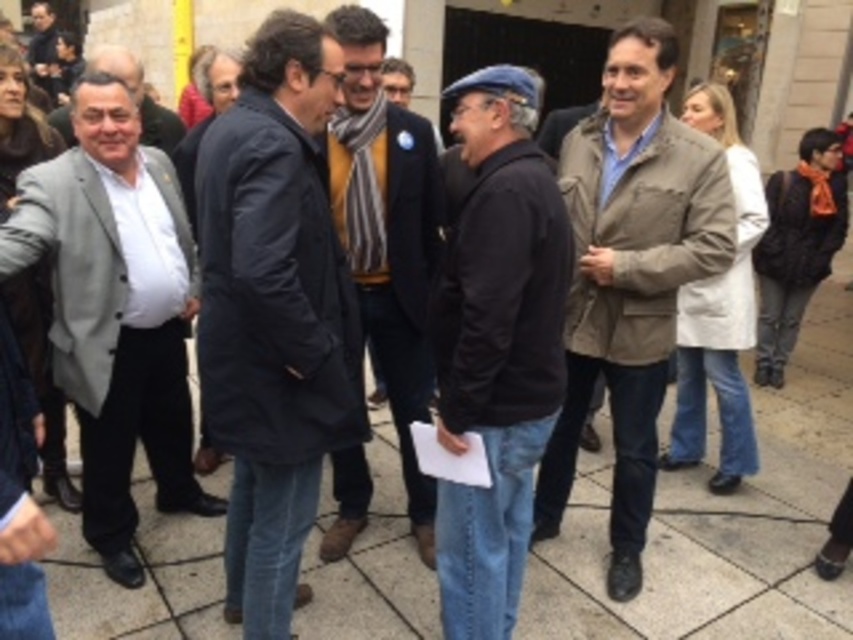
Between point (503, 90) and point (173, 138), which one is positioned behind?

Point (173, 138)

Does dark blue sweater at center have a lesser height compared to matte gray suit at left?

No.

Is point (529, 305) positioned in front of point (142, 104)?

That is True.

The width and height of the screenshot is (853, 640). Identify the location of dark blue sweater at center. (497, 346).

Does matte gray blazer at left come behind dark blue sweater at center?

Yes, it is behind dark blue sweater at center.

Can you confirm if matte gray blazer at left is shorter than dark blue sweater at center?

No.

In the scene shown: Who is more distant from viewer, (125, 500) or (525, 278)?

Positioned behind is point (125, 500).

Locate an element on the screen. matte gray blazer at left is located at coordinates (115, 310).

Does matte black coat at center have a greater height compared to matte gray suit at left?

Yes.

Between matte black coat at center and matte gray suit at left, which one is positioned lower?

matte black coat at center is lower down.

Who is more distant from viewer, (387, 378) or (111, 72)?

The point (111, 72) is more distant.

You are a GUI agent. You are given a task and a screenshot of the screen. Output one action in this format:
    pyautogui.click(x=<x>, y=<y>)
    Task: Click on the matte black coat at center
    
    Given the screenshot: What is the action you would take?
    pyautogui.click(x=387, y=236)